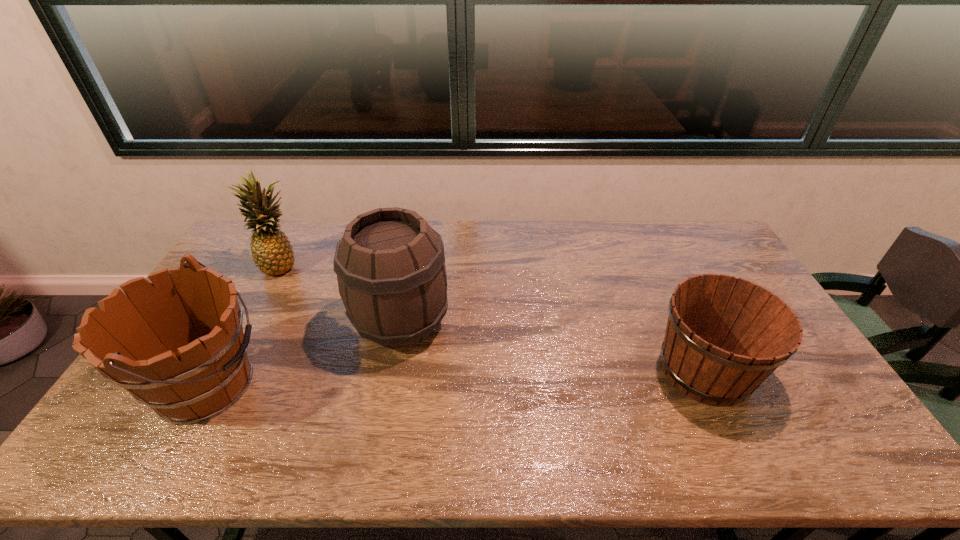
Where is `object that is at the near edge`? object that is at the near edge is located at coordinates (177, 345).

The width and height of the screenshot is (960, 540). I want to click on pineapple at the left edge, so click(x=272, y=253).

Find the location of `wine bucket present at the left edge`. wine bucket present at the left edge is located at coordinates (177, 345).

I want to click on object that is at the right edge, so click(725, 335).

Identify the location of object at the far left corner. (272, 253).

Find the location of a particular element. The image size is (960, 540). object positioned at the near left corner is located at coordinates (177, 345).

The height and width of the screenshot is (540, 960). Identify the location of vacant point at the far edge. (645, 246).

This screenshot has height=540, width=960. In the image, there is a desktop. What are the coordinates of `free space at the near edge` in the screenshot? It's located at (491, 444).

Where is `free space at the left edge of the desktop`? free space at the left edge of the desktop is located at coordinates (232, 278).

Find the location of a particular element. free space at the right edge of the desktop is located at coordinates (837, 422).